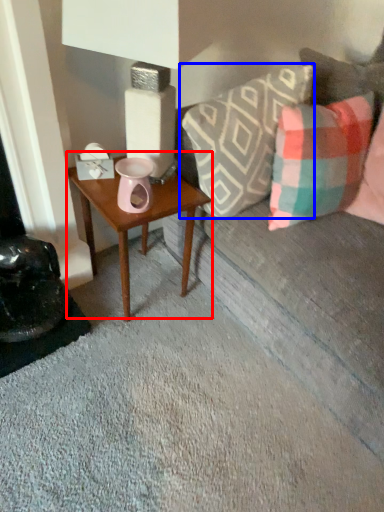
Question: Which object appears farthest to the camera in this image, table (highlighted by a red box) or pillow (highlighted by a blue box)?

Choices:
 (A) table
 (B) pillow

Answer: (A)